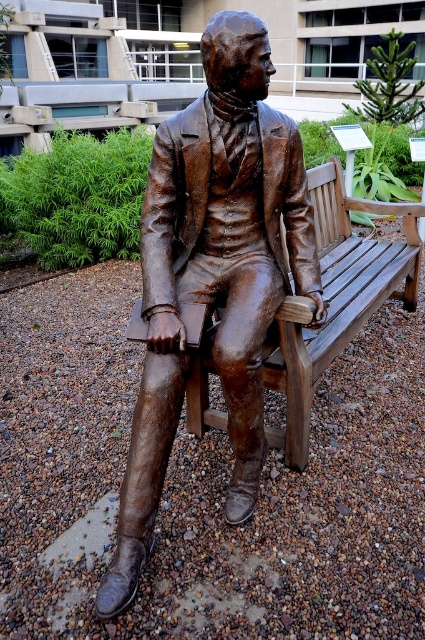
Is shiny bronze statue at center further to camera compared to wooden bench at center?

That is False.

Image resolution: width=425 pixels, height=640 pixels. What do you see at coordinates (212, 275) in the screenshot? I see `shiny bronze statue at center` at bounding box center [212, 275].

I want to click on shiny bronze statue at center, so click(x=212, y=275).